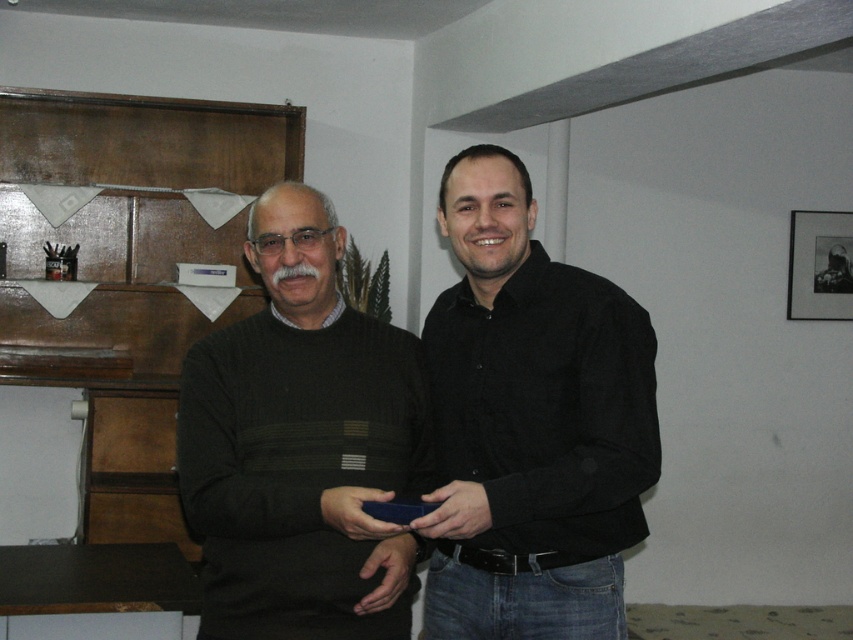
Does black matte shirt at center have a greater width compared to black matte picture frame at upper right?

Yes, black matte shirt at center is wider than black matte picture frame at upper right.

What do you see at coordinates (531, 424) in the screenshot? The height and width of the screenshot is (640, 853). I see `black matte shirt at center` at bounding box center [531, 424].

Locate an element on the screen. This screenshot has width=853, height=640. black matte shirt at center is located at coordinates (531, 424).

Is point (186, 433) less distant than point (843, 250)?

Yes, it is in front of point (843, 250).

Who is more forward, (180, 445) or (849, 250)?

Point (180, 445) is more forward.

Where is `dark green knitted sweater at left`? dark green knitted sweater at left is located at coordinates (300, 444).

In the scene shown: Is black matte shirt at center to the left of dark green knitted sweater at left from the viewer's perspective?

Incorrect, black matte shirt at center is not on the left side of dark green knitted sweater at left.

Is black matte shirt at center below dark green knitted sweater at left?

Incorrect, black matte shirt at center is not positioned below dark green knitted sweater at left.

Does point (498, 266) come behind point (318, 586)?

Yes, point (498, 266) is farther from viewer.

This screenshot has height=640, width=853. Find the location of `black matte shirt at center`. black matte shirt at center is located at coordinates (531, 424).